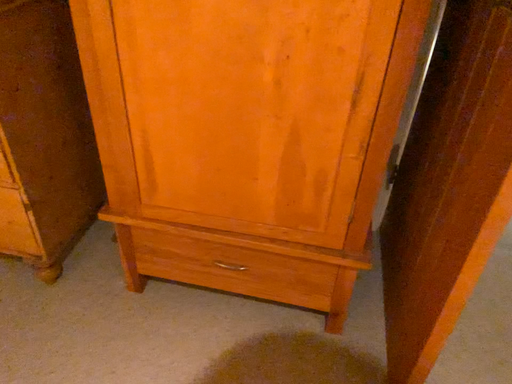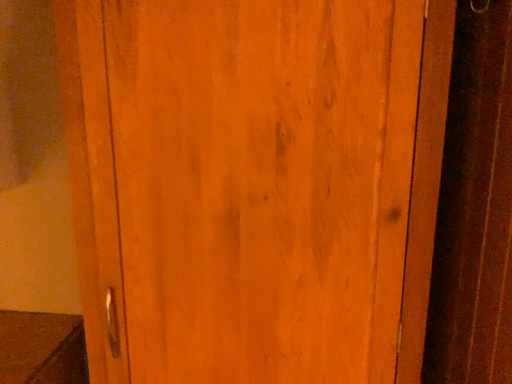
Question: Which way did the camera rotate in the video?

Choices:
 (A) rotated upward
 (B) rotated downward

Answer: (A)